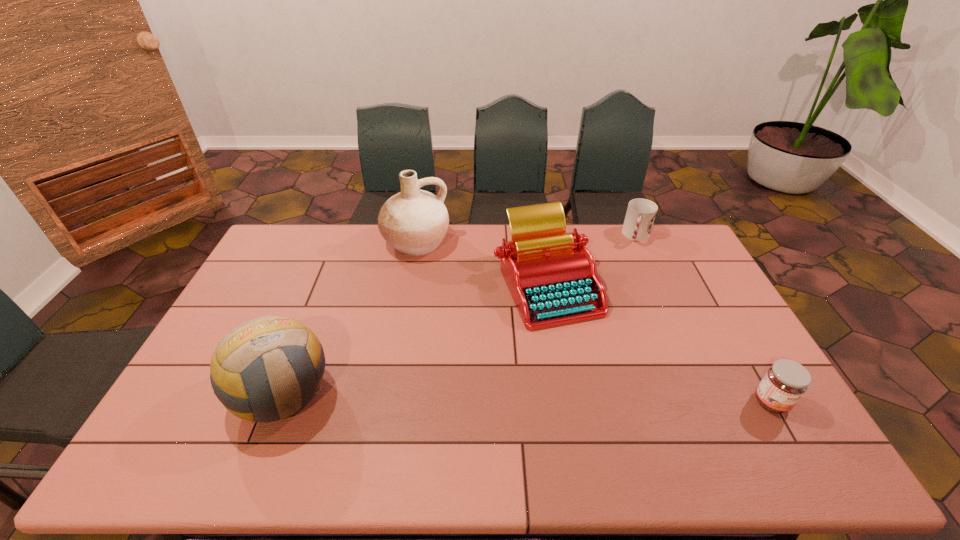
I want to click on vacant spot on the desktop that is between the fourth shortest object and the rightmost object and is positioned on the typing side of the third object from right to left, so click(519, 398).

Where is `free space on the desktop that is between the leftmost object and the jam and is positioned on the handle side of the fourth object from left to right`? free space on the desktop that is between the leftmost object and the jam and is positioned on the handle side of the fourth object from left to right is located at coordinates (589, 399).

Locate an element on the screen. This screenshot has height=540, width=960. free spot on the desktop that is between the volleyball and the jam and is positioned to pour from the handle of the pottery is located at coordinates (476, 397).